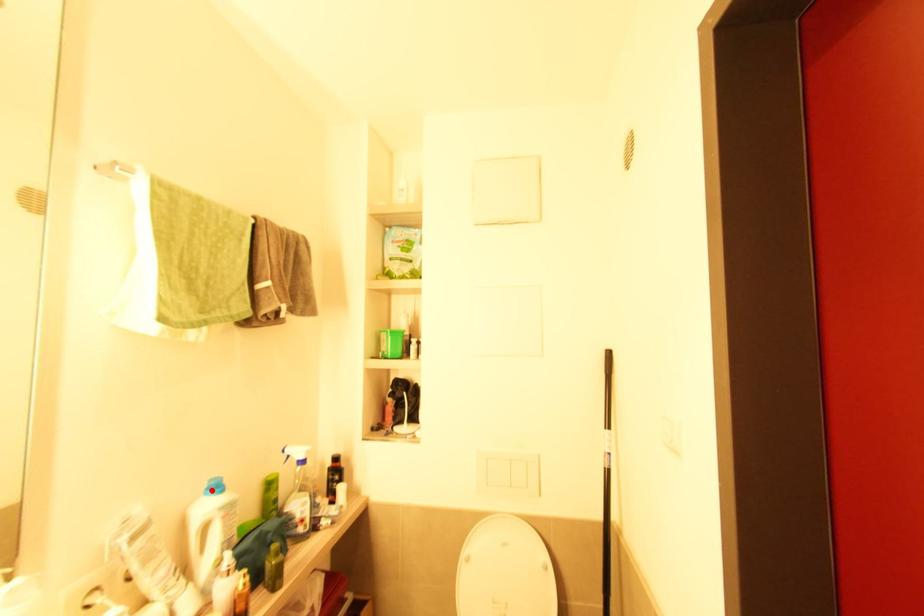
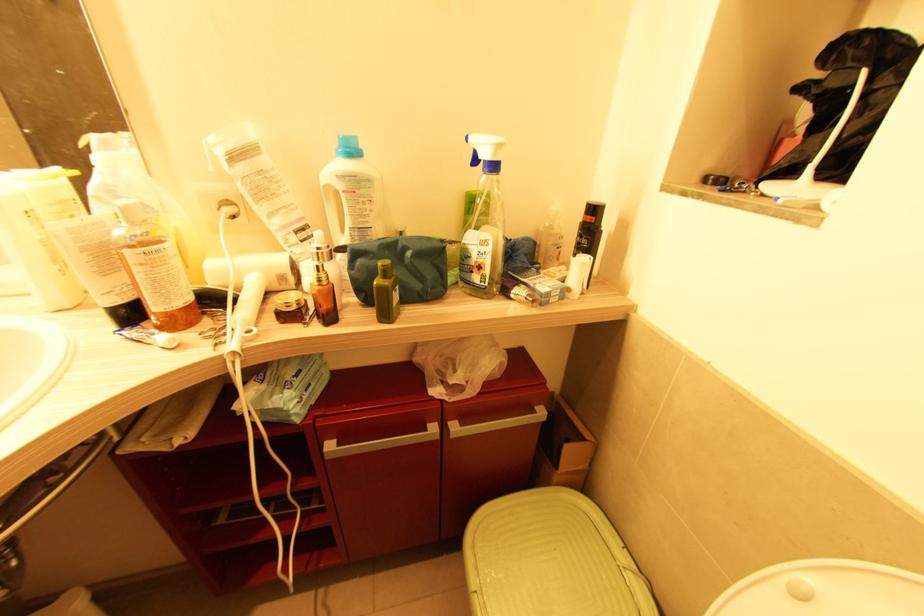
Find the pixel in the second image that matches the highlighted location in the first image.

(341, 148)